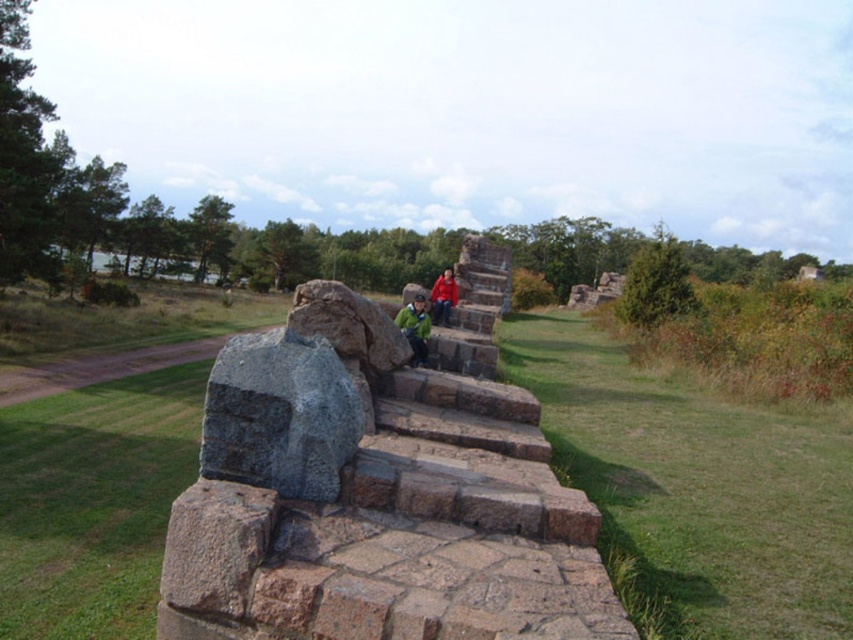
Question: Based on their relative distances, which object is nearer to the red fabric jacket at center?

Choices:
 (A) gray stone steps at center
 (B) green matte jacket at center

Answer: (B)

Question: Does green matte jacket at center appear under red fabric jacket at center?

Choices:
 (A) yes
 (B) no

Answer: (A)

Question: Which point is closer to the camera taking this photo?

Choices:
 (A) (381, 582)
 (B) (418, 304)

Answer: (A)

Question: Which point appears farthest from the camera in this image?

Choices:
 (A) (433, 561)
 (B) (447, 292)

Answer: (B)

Question: Is gray stone steps at center bigger than green matte jacket at center?

Choices:
 (A) yes
 (B) no

Answer: (A)

Question: Where is green matte jacket at center located in relation to red fabric jacket at center in the image?

Choices:
 (A) left
 (B) right

Answer: (A)